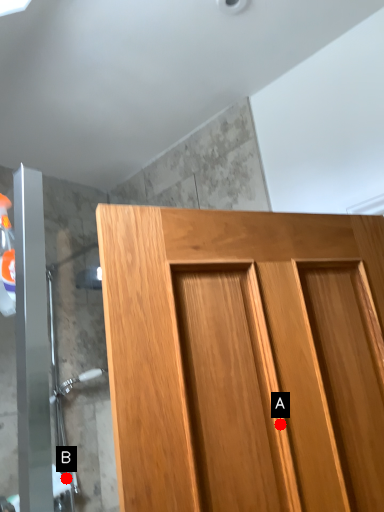
Question: Two points are circled on the image, labeled by A and B beside each circle. Among these points, which one is farthest from the camera?

Choices:
 (A) A is further
 (B) B is further

Answer: (B)